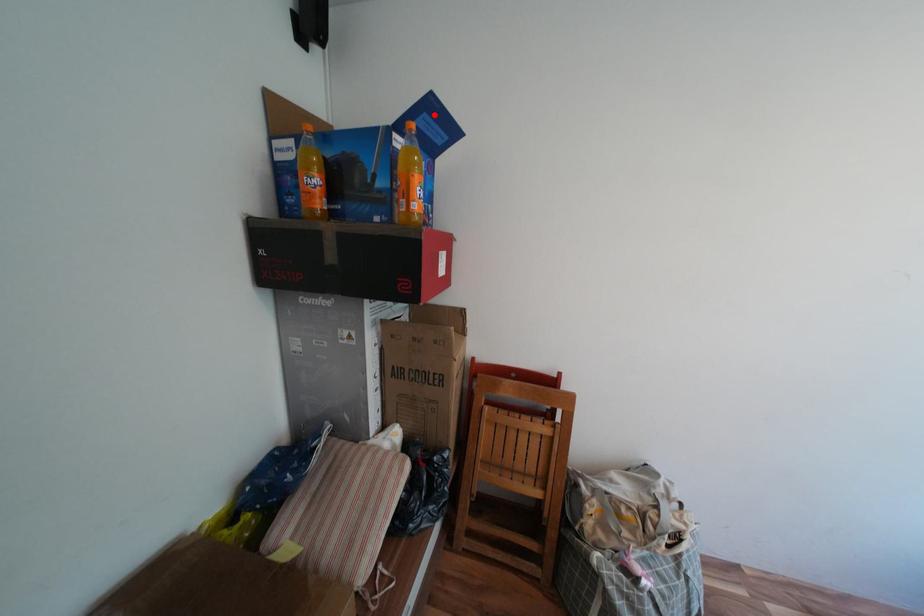
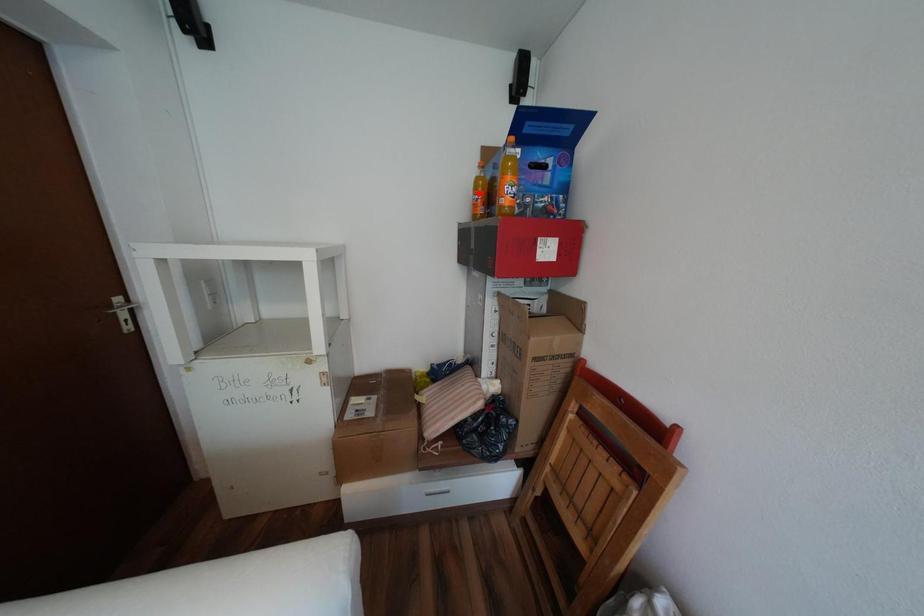
I am providing you with two images of the same scene from different viewpoints. A red point is marked on the first image and another point is marked on the second image. Does the point marked in image1 correspond to the same location as the one in image2?

No